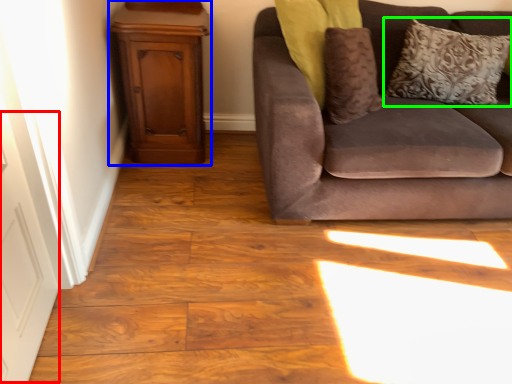
Question: Which object is positioned farthest from door (highlighted by a red box)? Select from dresser (highlighted by a blue box) and pillow (highlighted by a green box).

Choices:
 (A) dresser
 (B) pillow

Answer: (B)